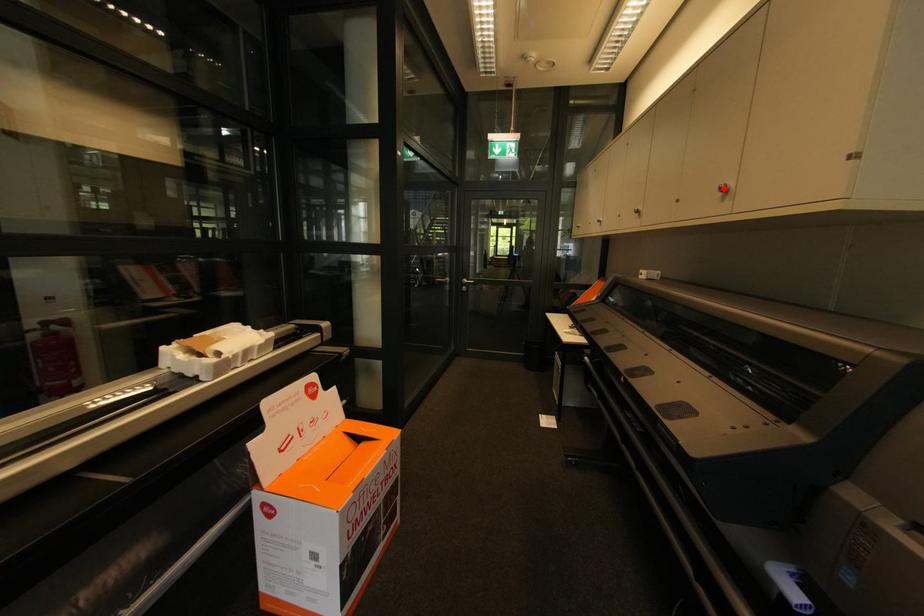
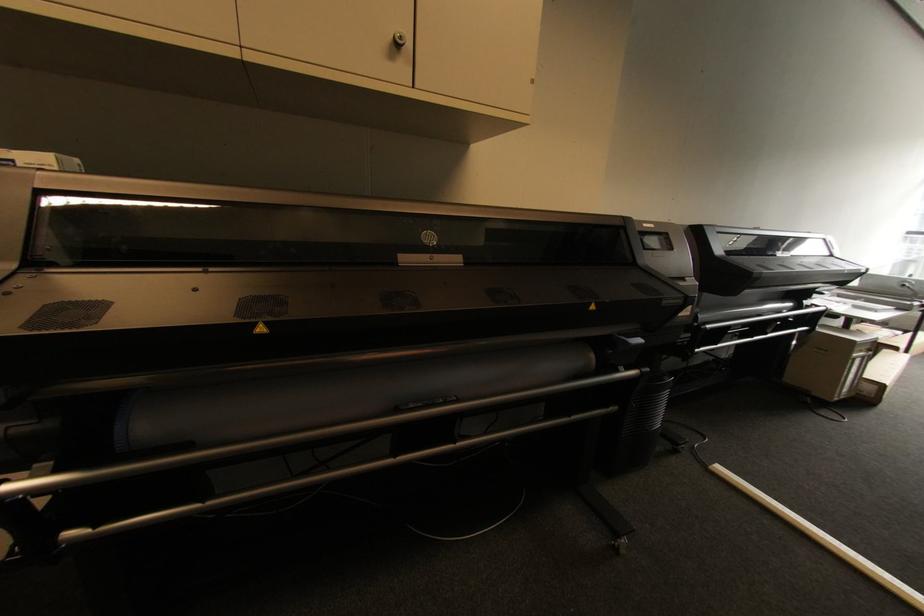
Find the pixel in the second image that matches the highlighted location in the first image.

(405, 38)